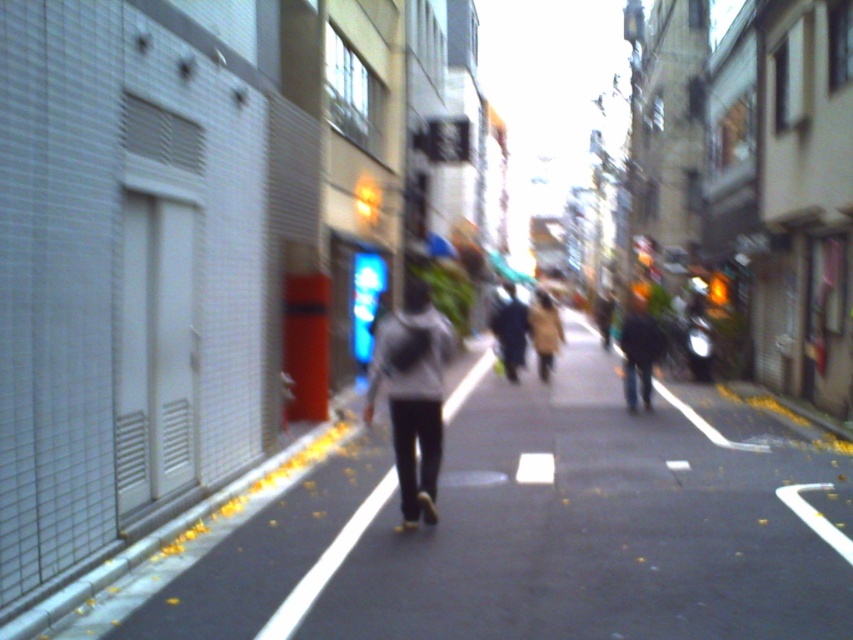
Does light gray sweater at center appear under dark gray sweater at center?

Indeed, light gray sweater at center is positioned under dark gray sweater at center.

Consider the image. Measure the distance from light gray sweater at center to dark gray sweater at center.

8.51 meters

Is point (374, 364) more distant than point (523, 308)?

No, it is not.

Image resolution: width=853 pixels, height=640 pixels. What are the coordinates of `light gray sweater at center` in the screenshot? It's located at (412, 394).